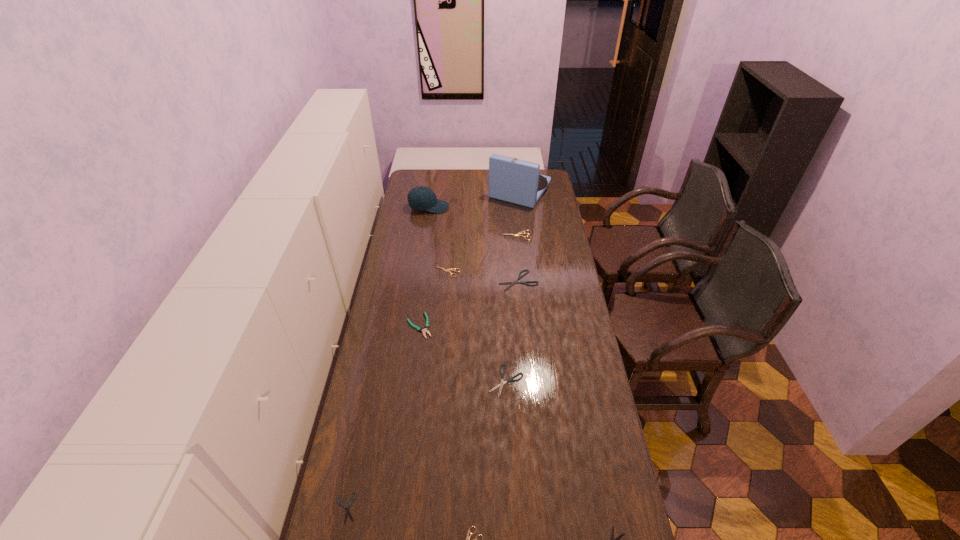
I want to click on the tallest object, so click(512, 180).

What are the coordinates of `blue phonograph record` in the screenshot? It's located at (512, 180).

The image size is (960, 540). Find the location of `blue baseball cap`. blue baseball cap is located at coordinates (419, 198).

Find the location of a particular element. Image resolution: width=960 pixels, height=540 pixels. baseball cap is located at coordinates (419, 198).

You are a GUI agent. You are given a task and a screenshot of the screen. Output one action in this format:
    pyautogui.click(x=<x>, y=<y>)
    Task: Click on the eighth shortest object
    The width and height of the screenshot is (960, 540).
    Given the screenshot: What is the action you would take?
    pyautogui.click(x=424, y=331)

You are a GUI agent. You are given a task and a screenshot of the screen. Output one action in this format:
    pyautogui.click(x=<x>, y=<y>)
    Task: Click on the fifth nearest object
    Image resolution: width=960 pixels, height=540 pixels.
    Given the screenshot: What is the action you would take?
    pyautogui.click(x=424, y=331)

Where is `the eighth nearest object`? The width and height of the screenshot is (960, 540). the eighth nearest object is located at coordinates (524, 231).

In order to click on the seventh shortest object in this screenshot , I will do `click(524, 231)`.

At what (x,y) coordinates should I click in order to perform the action: click on the biggest black shears. Please return your answer as a coordinate pair (x, y). The width and height of the screenshot is (960, 540). Looking at the image, I should click on (512, 283).

Locate an element on the screen. the sixth shears from right to left is located at coordinates (451, 269).